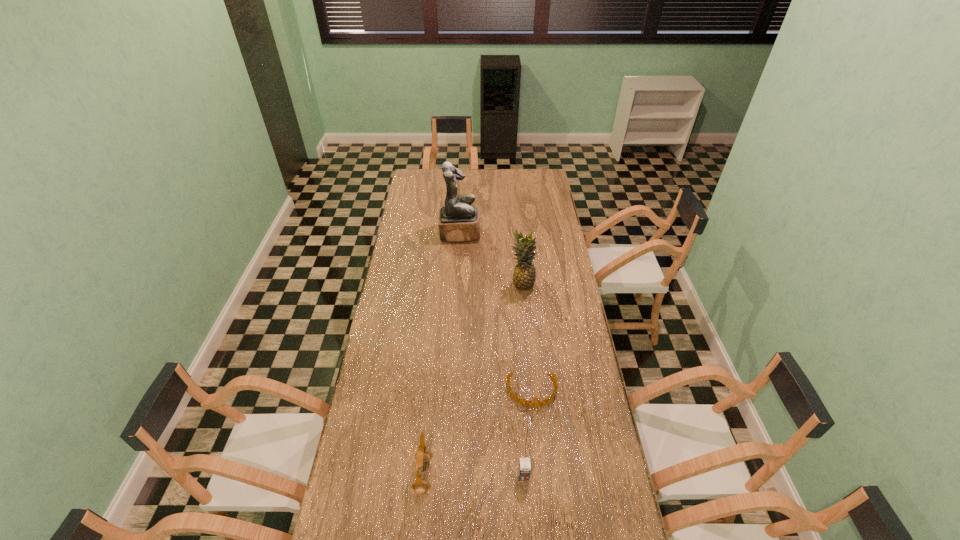
You are a GUI agent. You are given a task and a screenshot of the screen. Output one action in this format:
    pyautogui.click(x=<x>, y=<y>)
    Task: Click on the tallest object
    The width and height of the screenshot is (960, 540).
    Given the screenshot: What is the action you would take?
    pyautogui.click(x=459, y=221)

Locate an element on the screen. the farthest object is located at coordinates (459, 221).

Where is `the second tallest object`? The height and width of the screenshot is (540, 960). the second tallest object is located at coordinates (524, 275).

Identify the location of the fourth nearest object. This screenshot has height=540, width=960. (524, 275).

Where is `earphone`? The height and width of the screenshot is (540, 960). earphone is located at coordinates (422, 455).

Identify the location of the fourth tallest object. click(524, 468).

This screenshot has width=960, height=540. In order to click on the third farthest object in this screenshot , I will do `click(547, 400)`.

Identify the location of tiara. The height and width of the screenshot is (540, 960). (547, 400).

This screenshot has height=540, width=960. I want to click on vacant point located 0.110m in a relaxed pose on the farthest object, so click(x=500, y=233).

Image resolution: width=960 pixels, height=540 pixels. I want to click on vacant space located 0.220m on the front of the second farthest object, so point(526,330).